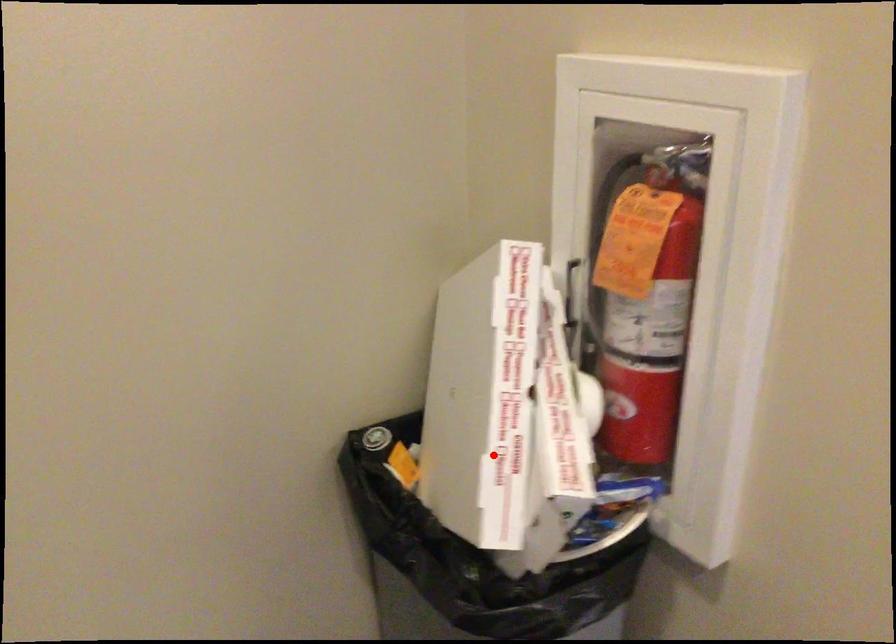
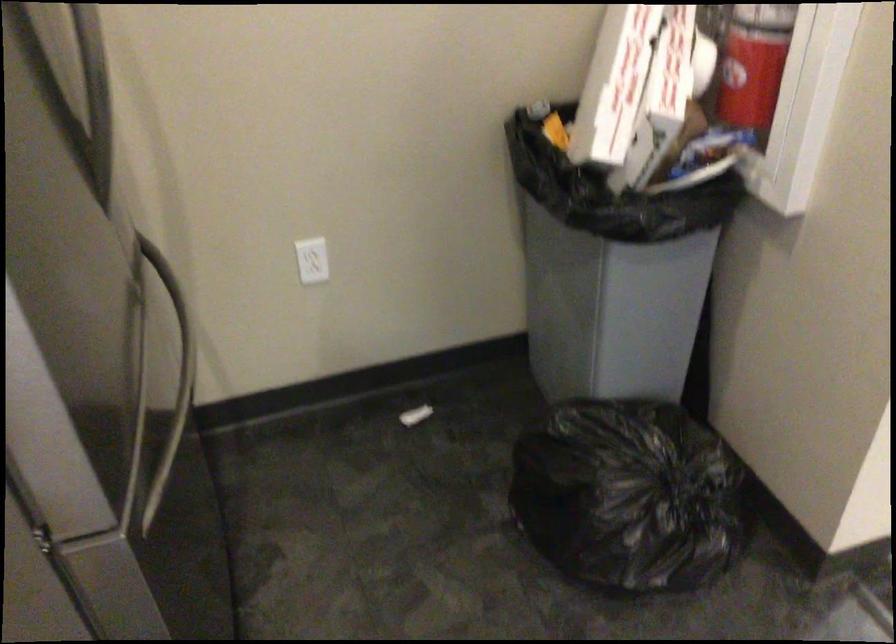
Question: I am providing you with two images of the same scene from different viewpoints. A red point is shown in image1. For the corresponding object point in image2, is it positioned nearer or farther from the camera?

Choices:
 (A) Nearer
 (B) Farther

Answer: (B)